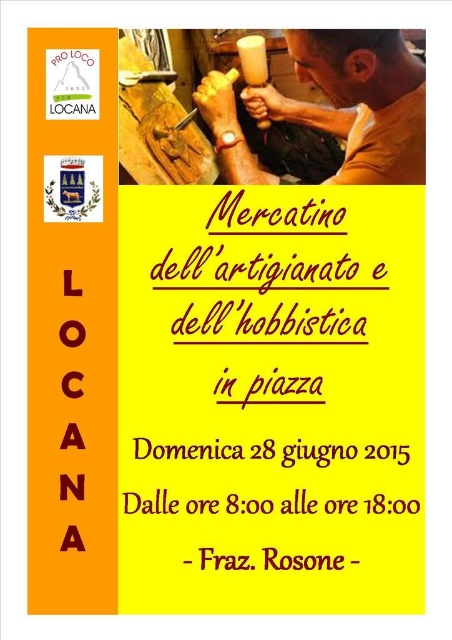
You are designing a poster and need to ensure that the matte brown wood at upper center and the matte yellow cup at upper center are visible. Given their sizes, which one will take up more vertical space on the poster?

The matte brown wood at upper center has a greater height compared to the matte yellow cup at upper center, so it will take up more vertical space on the poster.

You are designing a poster and want to place a decorative element above the matte brown wood at upper center and the matte yellow cup at upper center. Where should you place it to ensure it is above both?

The decorative element should be placed above both the matte brown wood at upper center and the matte yellow cup at upper center since the matte brown wood at upper center is positioned under the matte yellow cup at upper center, meaning the cup is higher up.

You are designing a layout for a poster and need to place two elements, the matte brown wood at upper center and the matte yellow cup at upper center. Which element should you make larger to ensure visual hierarchy?

The matte brown wood at upper center should be made larger since it is already larger in size than the matte yellow cup at upper center, establishing a clear visual hierarchy.